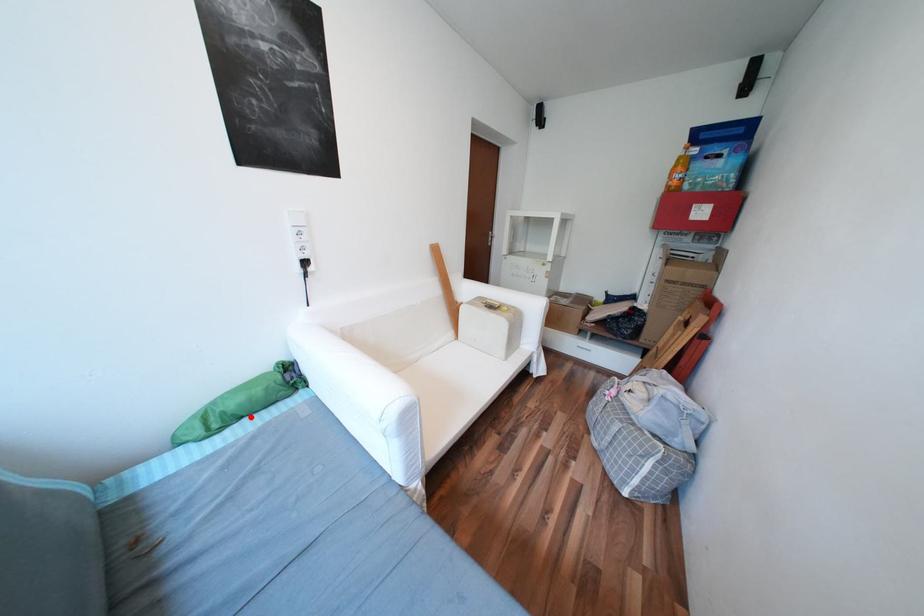
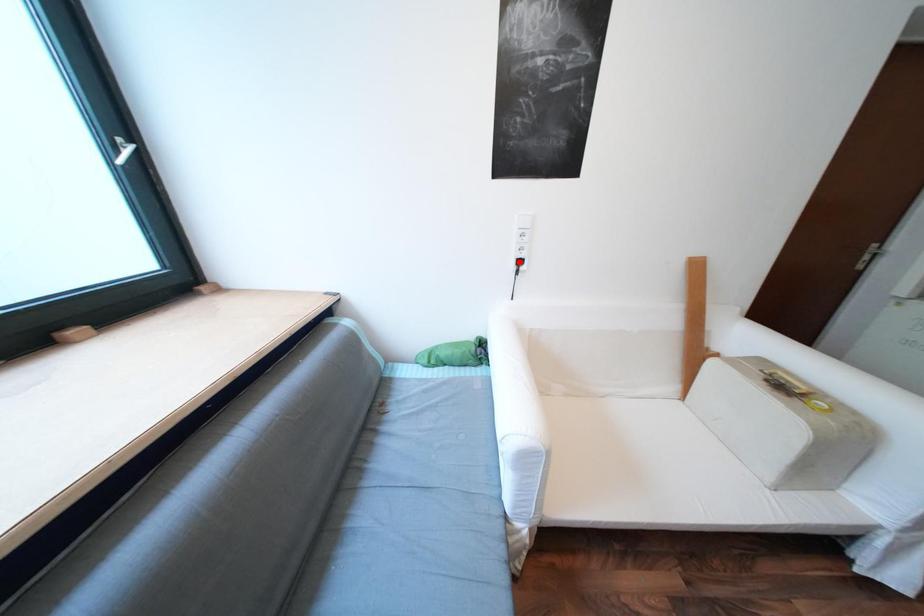
Based on the photo, I am providing you with two images of the same scene from different viewpoints. A red point is marked on the first image and another point is marked on the second image. Is the marked point in image1 the same physical position as the marked point in image2?

No